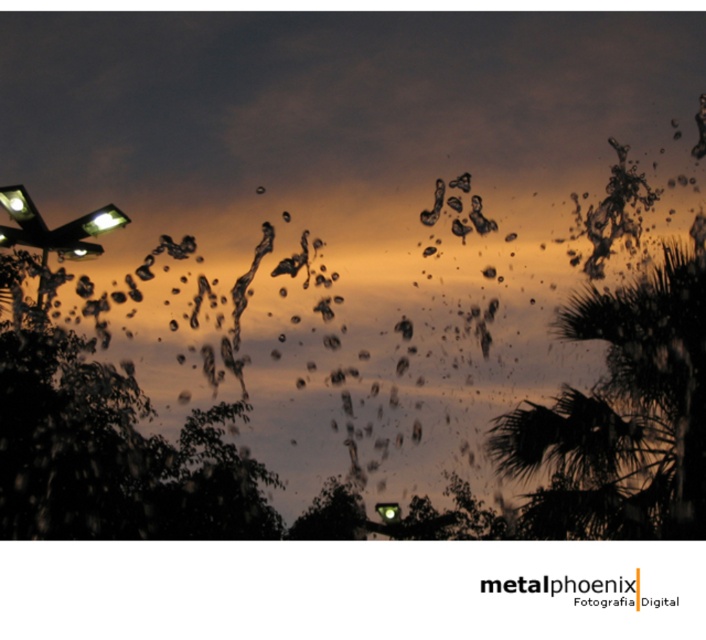
Can you confirm if metallic shiny bird at center is positioned above green glass traffic light at center?

Yes, metallic shiny bird at center is above green glass traffic light at center.

Identify the location of metallic shiny bird at center. (433, 204).

Image resolution: width=706 pixels, height=640 pixels. Describe the element at coordinates (433, 204) in the screenshot. I see `metallic shiny bird at center` at that location.

At what (x,y) coordinates should I click in order to perform the action: click on metallic shiny bird at center. Please return your answer as a coordinate pair (x, y). Image resolution: width=706 pixels, height=640 pixels. Looking at the image, I should click on (433, 204).

Which is below, translucent glass bird at upper center or green glass traffic light at center?

green glass traffic light at center is lower down.

Does point (472, 196) lie behind point (388, 524)?

No, (472, 196) is closer to viewer.

You are a GUI agent. You are given a task and a screenshot of the screen. Output one action in this format:
    pyautogui.click(x=<x>, y=<y>)
    Task: Click on the translucent glass bird at upper center
    The height and width of the screenshot is (640, 706).
    Given the screenshot: What is the action you would take?
    pyautogui.click(x=479, y=216)

Looking at this image, can you confirm if green leafy palm tree at center is positioned to the left of translucent glass bird at upper center?

No, green leafy palm tree at center is not to the left of translucent glass bird at upper center.

Is point (525, 458) farther from viewer compared to point (477, 221)?

No, it is in front of (477, 221).

The height and width of the screenshot is (640, 706). What do you see at coordinates (622, 417) in the screenshot? I see `green leafy palm tree at center` at bounding box center [622, 417].

I want to click on green leafy palm tree at center, so click(622, 417).